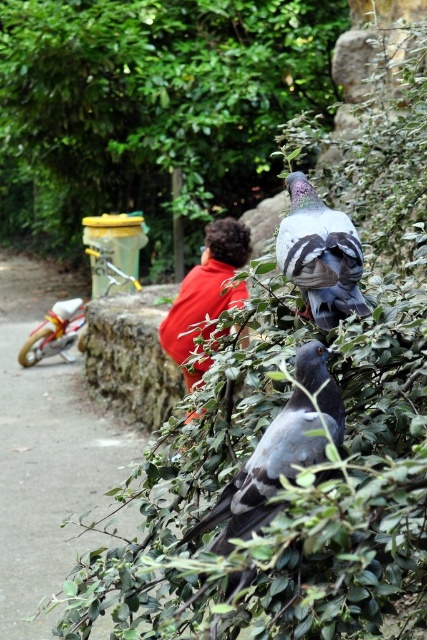
Looking at this image, who is shorter, green leafy tree at upper center or red cotton shirt at center?

green leafy tree at upper center

Does point (40, 138) lie behind point (245, 262)?

Yes, point (40, 138) is behind point (245, 262).

Does point (228, 68) lie behind point (224, 304)?

Yes, it is.

Find the location of a particular element. green leafy tree at upper center is located at coordinates (151, 108).

Is green leafy tree at upper center below gray matte pigeon at center?

Actually, green leafy tree at upper center is above gray matte pigeon at center.

What do you see at coordinates (151, 108) in the screenshot? This screenshot has width=427, height=640. I see `green leafy tree at upper center` at bounding box center [151, 108].

Locate an element on the screen. This screenshot has width=427, height=640. green leafy tree at upper center is located at coordinates [151, 108].

Between gray matte pigeon at center and gray matte pigeon at upper center, which one has more height?

gray matte pigeon at center

Which is in front, point (315, 422) or point (301, 211)?

Point (315, 422)

Locate an element on the screen. This screenshot has height=640, width=427. gray matte pigeon at center is located at coordinates (265, 474).

I want to click on gray matte pigeon at center, so coord(265,474).